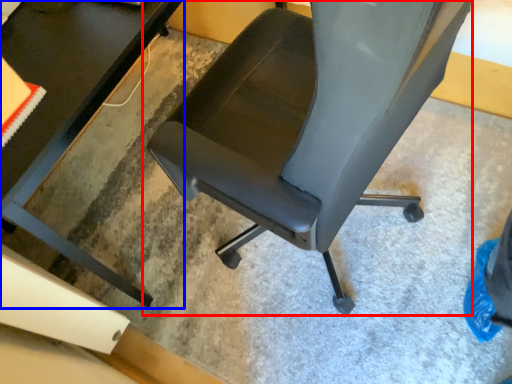
Question: Which of the following is the closest to the observer, chair (highlighted by a red box) or table (highlighted by a blue box)?

Choices:
 (A) chair
 (B) table

Answer: (A)